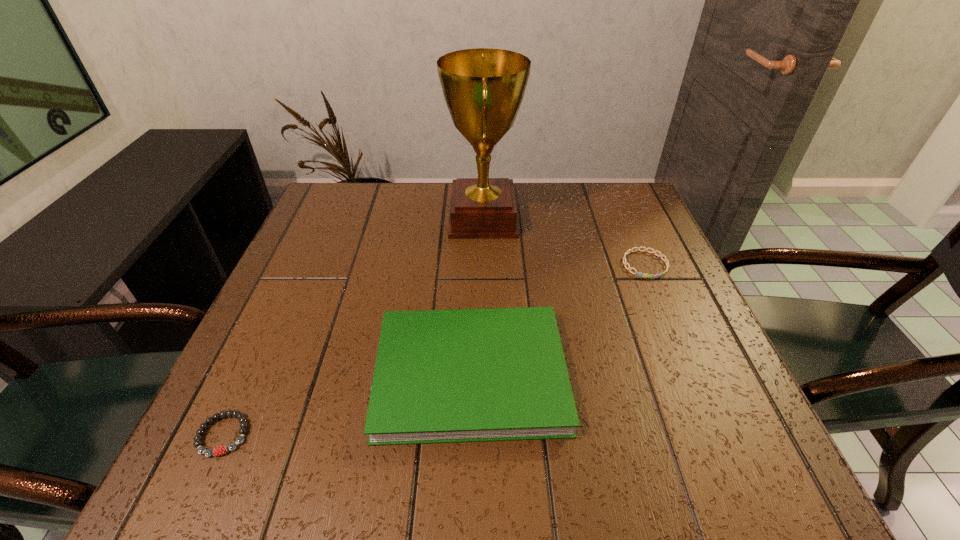
In the image, there is a desktop. What are the coordinates of `free space at the left edge` in the screenshot? It's located at (267, 381).

Find the location of `vacant space at the right edge`. vacant space at the right edge is located at coordinates (655, 318).

Locate an element on the screen. This screenshot has height=540, width=960. free space at the far left corner is located at coordinates (328, 185).

Image resolution: width=960 pixels, height=540 pixels. What are the coordinates of `blank space at the far right corner of the desktop` in the screenshot? It's located at (626, 202).

At what (x,y) coordinates should I click in order to perform the action: click on free spot between the rightmost object and the third shortest object. Please return your answer as a coordinate pair (x, y). This screenshot has width=960, height=540. Looking at the image, I should click on (558, 319).

Identify the location of empty space between the leftmost object and the paperback book. (348, 404).

Find the location of a particular element. Image resolution: width=960 pixels, height=540 pixels. free point between the leftmost object and the paperback book is located at coordinates (348, 404).

Locate an element on the screen. The width and height of the screenshot is (960, 540). free point between the paperback book and the nearer bracelet is located at coordinates (348, 404).

Where is `free point between the paperback book and the left bracelet`? free point between the paperback book and the left bracelet is located at coordinates (348, 404).

Where is `unoccupied area between the left bracelet and the second tallest object`? Image resolution: width=960 pixels, height=540 pixels. unoccupied area between the left bracelet and the second tallest object is located at coordinates (348, 404).